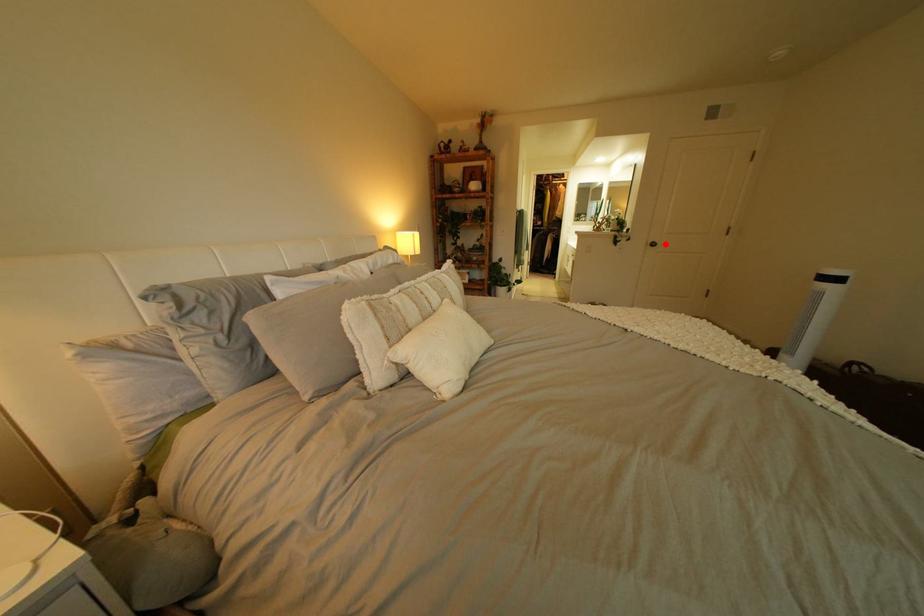
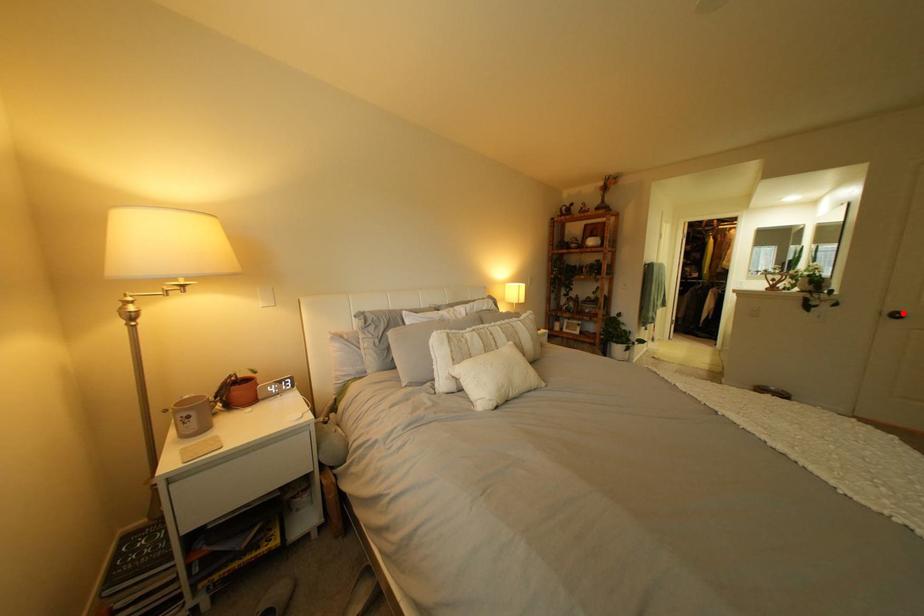
I am providing you with two images of the same scene from different viewpoints. A red point is marked on the first image and another point is marked on the second image. Does the point marked in image1 correspond to the same location as the one in image2?

Yes